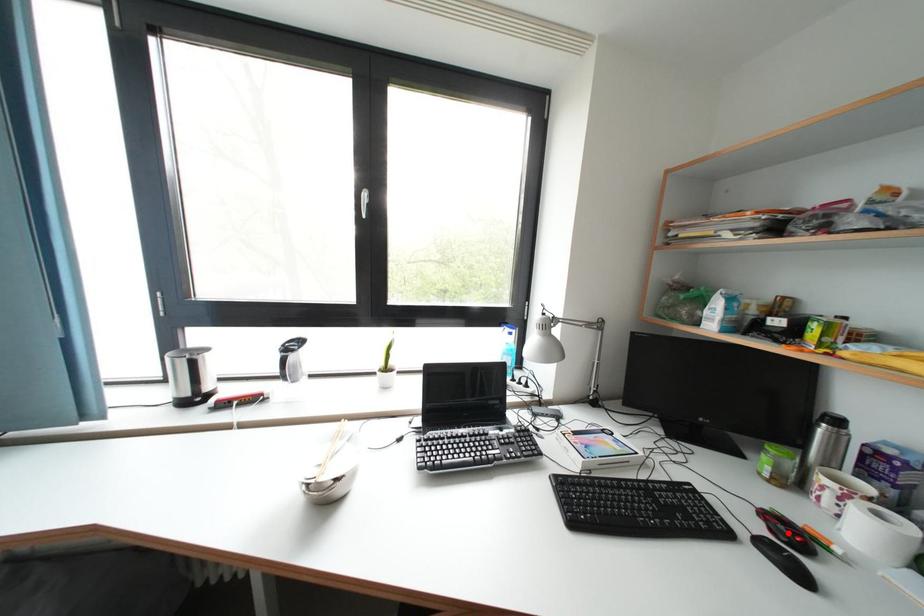
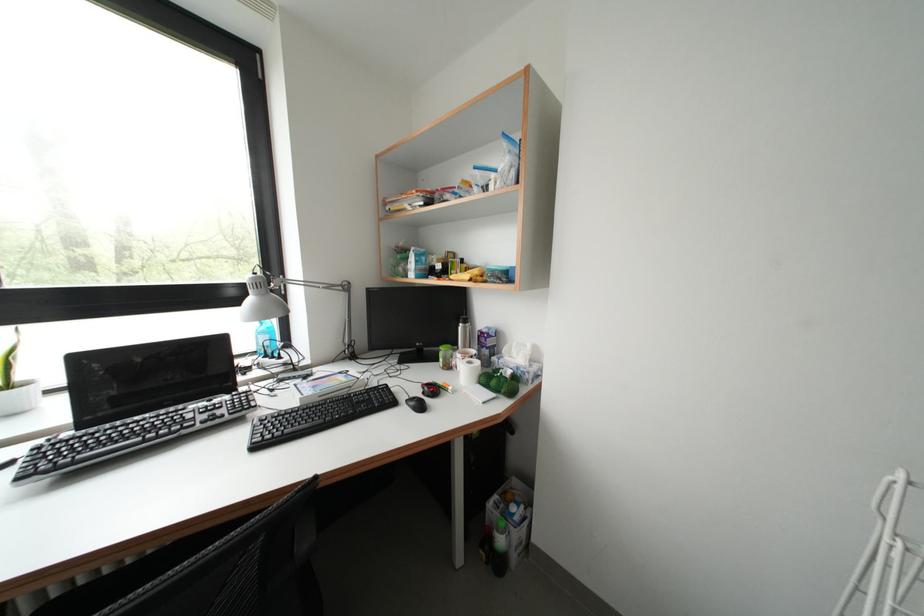
Find the pixel in the second image that matches the highlighted location in the first image.

(432, 392)